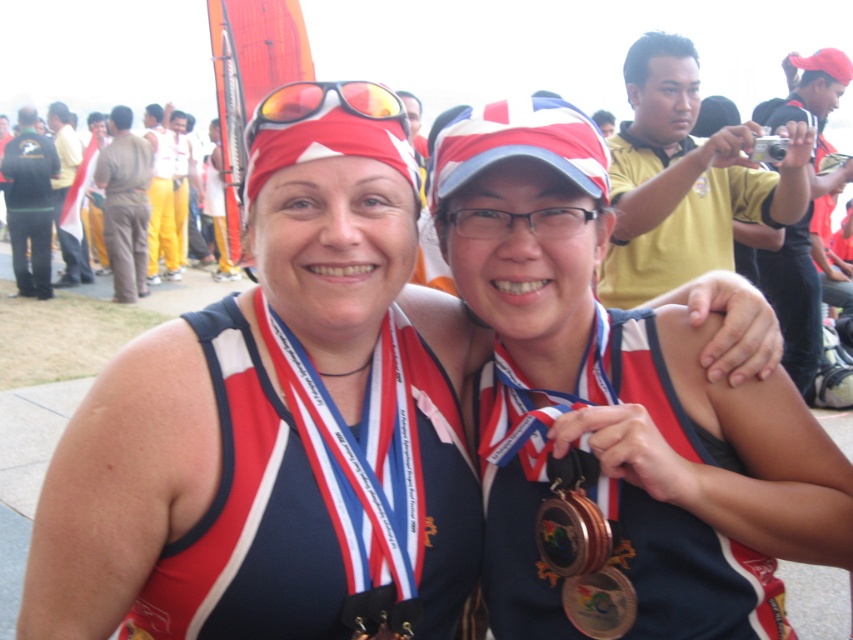
You are a photographer trying to capture a closeup of the shiny orange goggles at upper center without the matte plastic goggles at center appearing in the frame. Is this possible given their positions?

The shiny orange goggles at upper center is positioned over matte plastic goggles at center, so it would block the view of the matte plastic goggles at center. Therefore, you can take a closeup of the shiny orange goggles at upper center without the matte plastic goggles at center showing in the frame.

You are a photographer who needs to capture a closeup of the shiny gold medal at center and the matte plastic goggles at center. Which object is located to the left of the other?

The matte plastic goggles at center are located to the left of the shiny gold medal at center.

You are a photographer trying to capture a closeup of the shiny orange goggles at upper center. The camera you are using has a focal length of 50mm. Given that the goggles are located at coordinates point 0.164, 0.382, can you determine if they will be in the frame? Please explain your reasoning.

The shiny orange goggles at upper center are positioned at coordinates point (325, 104). Since the photographer is aiming for a closeup, and the coordinates fall within the standard frame boundaries of a 50mm lens, the goggles will be in the frame.